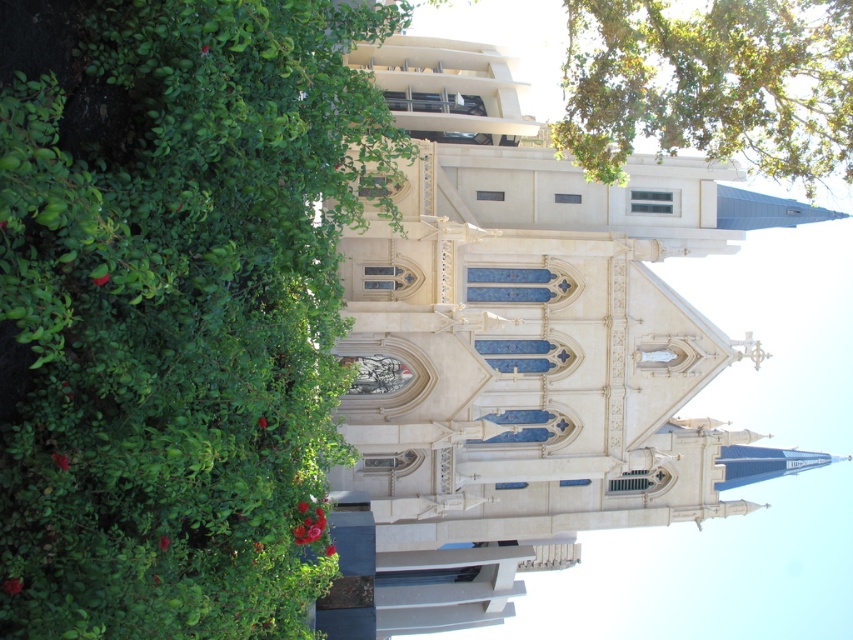
Who is shorter, green leafy bush at left or white stone church steeple at center?

Standing shorter between the two is green leafy bush at left.

Between green leafy bush at left and white stone church steeple at center, which one appears on the right side from the viewer's perspective?

Positioned to the right is white stone church steeple at center.

Locate an element on the screen. green leafy bush at left is located at coordinates (178, 314).

Between green leafy bush at left and green leafy tree at upper right, which one has more height?

green leafy bush at left is taller.

Between point (177, 522) and point (648, 118), which one is positioned behind?

Point (648, 118)

The width and height of the screenshot is (853, 640). I want to click on green leafy bush at left, so pos(178,314).

Is the position of white stone church steeple at center more distant than that of green leafy tree at upper right?

That is True.

Which is below, white stone church steeple at center or green leafy tree at upper right?

white stone church steeple at center is lower down.

Is point (548, 305) closer to viewer compared to point (624, 116)?

No, it is behind (624, 116).

What are the coordinates of `white stone church steeple at center` in the screenshot? It's located at (523, 355).